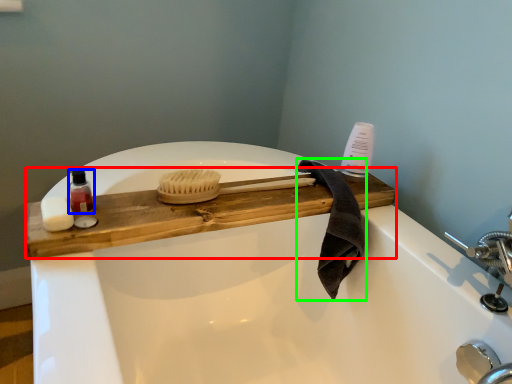
Question: Estimate the real-world distances between objects in this image. Which object is farther from counter top (highlighted by a red box), toiletry (highlighted by a blue box) or bath towel (highlighted by a green box)?

Choices:
 (A) toiletry
 (B) bath towel

Answer: (A)